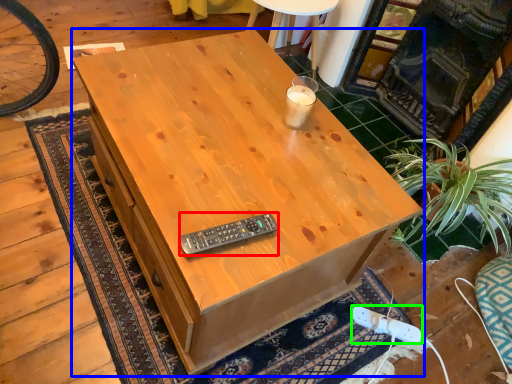
Question: Based on their relative distances, which object is farther from control (highlighted by a red box)? Choose from desk (highlighted by a blue box) and plug (highlighted by a green box).

Choices:
 (A) desk
 (B) plug

Answer: (B)